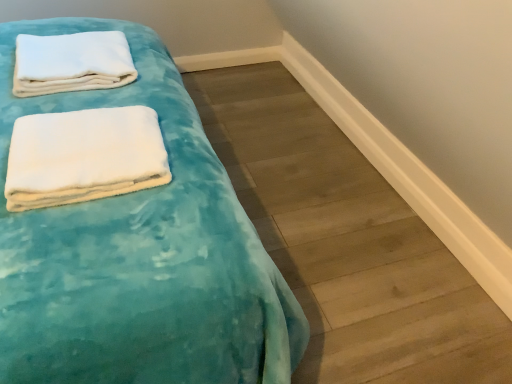
Question: Does teal velvety bed at left have a larger size compared to teal velvety blanket at upper left?

Choices:
 (A) yes
 (B) no

Answer: (A)

Question: Does teal velvety bed at left appear on the right side of teal velvety blanket at upper left?

Choices:
 (A) yes
 (B) no

Answer: (B)

Question: From a real-world perspective, is teal velvety bed at left under teal velvety blanket at upper left?

Choices:
 (A) no
 (B) yes

Answer: (A)

Question: Is teal velvety bed at left completely or partially outside of teal velvety blanket at upper left?

Choices:
 (A) no
 (B) yes

Answer: (B)

Question: Can you confirm if teal velvety bed at left is wider than teal velvety blanket at upper left?

Choices:
 (A) yes
 (B) no

Answer: (B)

Question: Does teal velvety bed at left have a greater height compared to teal velvety blanket at upper left?

Choices:
 (A) yes
 (B) no

Answer: (A)

Question: Can you confirm if white soft towel at upper left, which ranks as the first towel in top-to-bottom order, is wider than white soft towel at upper left, the second towel when ordered from back to front?

Choices:
 (A) yes
 (B) no

Answer: (A)

Question: Is white soft towel at upper left, positioned as the first towel in bottom-to-top order, at the back of white soft towel at upper left, positioned as the 1th towel in back-to-front order?

Choices:
 (A) yes
 (B) no

Answer: (B)

Question: Is the surface of white soft towel at upper left, which ranks as the first towel in top-to-bottom order, in direct contact with white soft towel at upper left, the 2th towel when ordered from top to bottom?

Choices:
 (A) no
 (B) yes

Answer: (A)

Question: Is white soft towel at upper left, the second towel when ordered from back to front, inside white soft towel at upper left, positioned as the 1th towel in back-to-front order?

Choices:
 (A) yes
 (B) no

Answer: (B)

Question: From the image's perspective, would you say white soft towel at upper left, the 2th towel when ordered from bottom to top, is shown under white soft towel at upper left, the second towel when ordered from back to front?

Choices:
 (A) yes
 (B) no

Answer: (B)

Question: Does white soft towel at upper left, positioned as the 1th towel in back-to-front order, have a lesser height compared to white soft towel at upper left, the second towel when ordered from back to front?

Choices:
 (A) no
 (B) yes

Answer: (A)

Question: Can you confirm if white soft towel at upper left, which ranks as the first towel in top-to-bottom order, is shorter than teal velvety blanket at upper left?

Choices:
 (A) yes
 (B) no

Answer: (B)